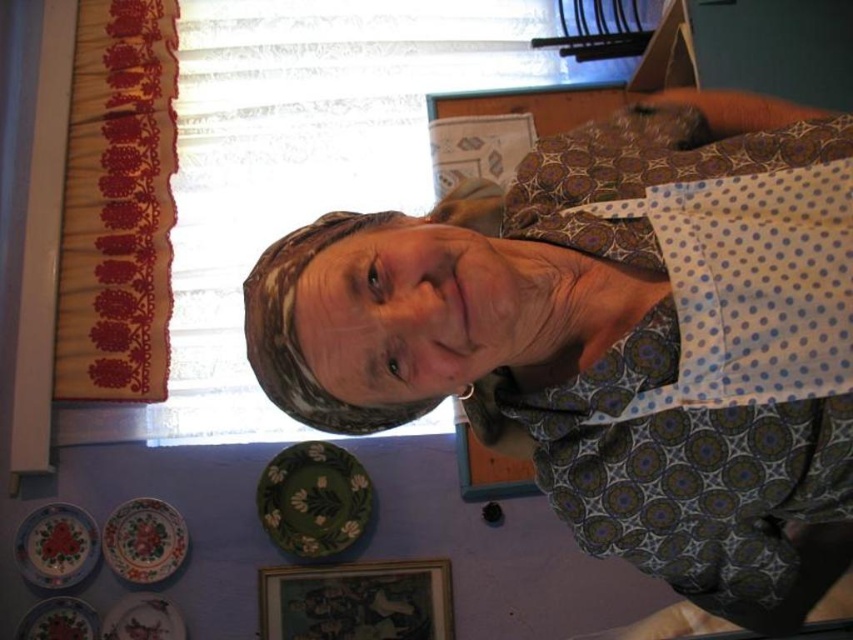
Question: Considering the relative positions of green matte plate at lower left and matte ceramic plate at lower left in the image provided, where is green matte plate at lower left located with respect to matte ceramic plate at lower left?

Choices:
 (A) left
 (B) right

Answer: (B)

Question: Which of the following is the closest to the observer?

Choices:
 (A) [x=683, y=109]
 (B) [x=171, y=568]

Answer: (A)

Question: Does matte ceramic plate at lower left appear under white glossy plate at lower left?

Choices:
 (A) yes
 (B) no

Answer: (B)

Question: Does green matte plate at lower left have a smaller size compared to white glossy plate at lower left?

Choices:
 (A) yes
 (B) no

Answer: (B)

Question: Which point appears closest to the camera in this image?

Choices:
 (A) (360, 250)
 (B) (47, 621)
 (C) (142, 556)
 (D) (67, 544)

Answer: (A)

Question: Which point is farther from the camera taking this photo?

Choices:
 (A) (167, 620)
 (B) (50, 624)

Answer: (A)